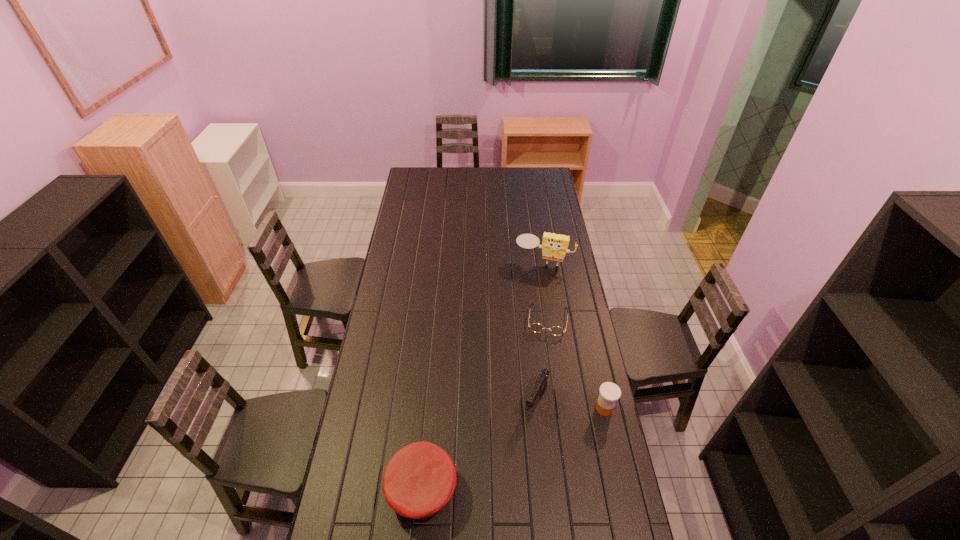
The width and height of the screenshot is (960, 540). Find the location of `vacant space on the desktop that is between the leftmost object and the medicine and is positioned on the lenses of the shortest object`. vacant space on the desktop that is between the leftmost object and the medicine and is positioned on the lenses of the shortest object is located at coordinates (533, 440).

You are a GUI agent. You are given a task and a screenshot of the screen. Output one action in this format:
    pyautogui.click(x=<x>, y=<y>)
    Task: Click on the free space on the desktop that is between the leftmost object and the medicine and is positioned on the front-facing side of the tallest object
    
    Given the screenshot: What is the action you would take?
    pyautogui.click(x=492, y=458)

Image resolution: width=960 pixels, height=540 pixels. I want to click on vacant spot on the desktop that is between the leftmost object and the medicine and is positioned at the barrel of the pistol, so click(x=513, y=449).